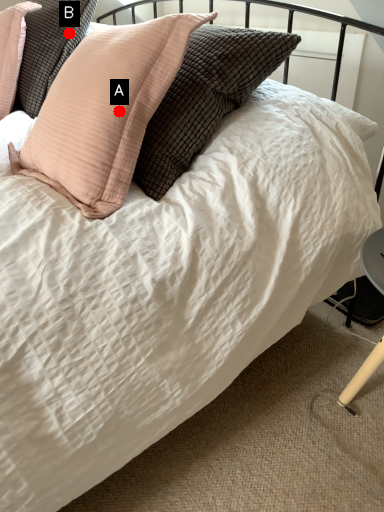
Question: Two points are circled on the image, labeled by A and B beside each circle. Which of the following is the closest to the observer?

Choices:
 (A) A is closer
 (B) B is closer

Answer: (A)